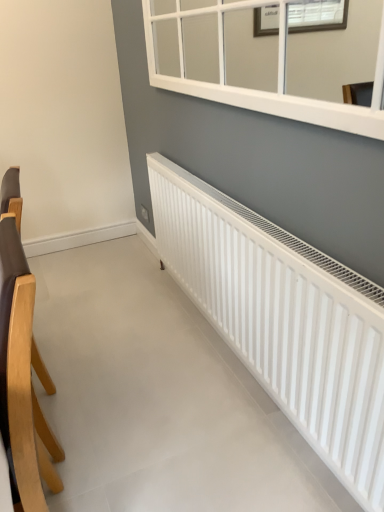
Locate an element on the screen. The image size is (384, 512). brown leather chair at left is located at coordinates (19, 372).

What is the approximate height of brown leather chair at left?

It is 36.20 inches.

The width and height of the screenshot is (384, 512). What do you see at coordinates (19, 372) in the screenshot?
I see `brown leather chair at left` at bounding box center [19, 372].

Measure the distance between point (29, 488) and camera.

Point (29, 488) and camera are 32.36 inches apart from each other.

Find the location of a particular element. white matte radiator at lower right is located at coordinates (283, 319).

This screenshot has width=384, height=512. Describe the element at coordinates (283, 319) in the screenshot. I see `white matte radiator at lower right` at that location.

Image resolution: width=384 pixels, height=512 pixels. Find the location of `brown leather chair at left`. brown leather chair at left is located at coordinates (19, 372).

Which object is positioned more to the left, brown leather chair at left or white matte radiator at lower right?

brown leather chair at left.

Relative to white matte radiator at lower right, is brown leather chair at left in front or behind?

In the image, brown leather chair at left appears in front of white matte radiator at lower right.

Between point (32, 445) and point (231, 323), which one is positioned behind?

The point (231, 323) is more distant.

From the image's perspective, between brown leather chair at left and white matte radiator at lower right, who is located below?

brown leather chair at left, from the image's perspective.

From a real-world perspective, does brown leather chair at left stand above white matte radiator at lower right?

Yes.

Does brown leather chair at left have a greater width compared to white matte radiator at lower right?

Incorrect, the width of brown leather chair at left does not surpass that of white matte radiator at lower right.

Considering the sizes of objects brown leather chair at left and white matte radiator at lower right in the image provided, who is shorter, brown leather chair at left or white matte radiator at lower right?

white matte radiator at lower right is shorter.

Considering the sizes of objects brown leather chair at left and white matte radiator at lower right in the image provided, who is smaller, brown leather chair at left or white matte radiator at lower right?

brown leather chair at left.

Can we say brown leather chair at left lies outside white matte radiator at lower right?

Indeed, brown leather chair at left is completely outside white matte radiator at lower right.

Is brown leather chair at left next to white matte radiator at lower right?

No, brown leather chair at left is not in contact with white matte radiator at lower right.

Is brown leather chair at left facing towards white matte radiator at lower right?

No, brown leather chair at left is not aimed at white matte radiator at lower right.

Where is `radiator that is under the brown leather chair at left (from a real-world perspective)`? The height and width of the screenshot is (512, 384). radiator that is under the brown leather chair at left (from a real-world perspective) is located at coordinates (283, 319).

Between white matte radiator at lower right and brown leather chair at left, which one appears on the right side from the viewer's perspective?

Positioned to the right is white matte radiator at lower right.

In the image, is white matte radiator at lower right positioned in front of or behind brown leather chair at left?

In the image, white matte radiator at lower right appears behind brown leather chair at left.

Between point (257, 284) and point (20, 430), which one is positioned in front?

Positioned in front is point (20, 430).

From the image's perspective, is white matte radiator at lower right above or below brown leather chair at left?

Based on their image positions, white matte radiator at lower right is located above brown leather chair at left.

From a real-world perspective, which is physically below, white matte radiator at lower right or brown leather chair at left?

From a 3D spatial view, white matte radiator at lower right is below.

Between white matte radiator at lower right and brown leather chair at left, which one has larger width?

white matte radiator at lower right is wider.

Considering the sizes of objects white matte radiator at lower right and brown leather chair at left in the image provided, who is taller, white matte radiator at lower right or brown leather chair at left?

brown leather chair at left.

Based on the photo, considering the relative sizes of white matte radiator at lower right and brown leather chair at left in the image provided, is white matte radiator at lower right bigger than brown leather chair at left?

Correct, white matte radiator at lower right is larger in size than brown leather chair at left.

Consider the image. Is white matte radiator at lower right outside of brown leather chair at left?

Yes.

Can you see white matte radiator at lower right touching brown leather chair at left?

No, white matte radiator at lower right is not next to brown leather chair at left.

Is white matte radiator at lower right turned away from brown leather chair at left?

white matte radiator at lower right does not have its back to brown leather chair at left.

How distant is white matte radiator at lower right from brown leather chair at left?

white matte radiator at lower right is 30.64 inches from brown leather chair at left.

You are a GUI agent. You are given a task and a screenshot of the screen. Output one action in this format:
    pyautogui.click(x=<x>, y=<y>)
    Task: Click on the chair to the left of white matte radiator at lower right
    The image size is (384, 512).
    Given the screenshot: What is the action you would take?
    pyautogui.click(x=19, y=372)

At what (x,y) coordinates should I click in order to perform the action: click on radiator behind the brown leather chair at left. Please return your answer as a coordinate pair (x, y). This screenshot has height=512, width=384. Looking at the image, I should click on (283, 319).

Where is `chair positioned vertically above the white matte radiator at lower right (from a real-world perspective)`? The width and height of the screenshot is (384, 512). chair positioned vertically above the white matte radiator at lower right (from a real-world perspective) is located at coordinates (19, 372).